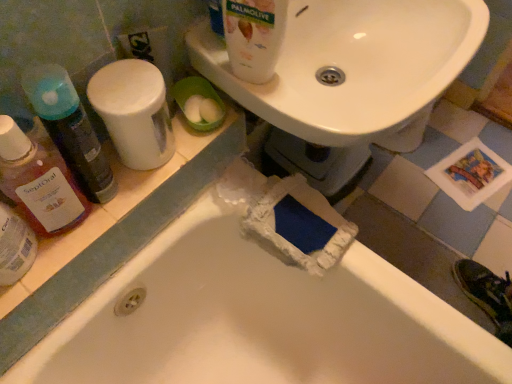
How much space does white glossy bottle at upper center, which is the 4th cleaning product in left-to-right order, occupy horizontally?

2.69 inches.

Describe the element at coordinates (134, 112) in the screenshot. I see `white plastic container at upper left, which appears as the second cleaning product when viewed from the right` at that location.

This screenshot has height=384, width=512. I want to click on white glossy sink at upper center, so click(x=352, y=65).

In order to face translucent plastic bottle at left, which ranks as the 3th cleaning product in right-to-left order, should I rotate leftwards or rightwards?

To face it directly, rotate left by 22.165 degrees.

Find the location of a particular element. The width and height of the screenshot is (512, 384). white matte bathtub at lower left is located at coordinates (259, 316).

Is translucent plastic mouthwash at left positioned beyond the bounds of white glossy bottle at upper center, which is the 4th cleaning product in left-to-right order?

Yes, translucent plastic mouthwash at left is located beyond the bounds of white glossy bottle at upper center, which is the 4th cleaning product in left-to-right order.

Between translucent plastic mouthwash at left and white glossy bottle at upper center, which is the 4th cleaning product in left-to-right order, which one has larger size?

With larger size is white glossy bottle at upper center, which is the 4th cleaning product in left-to-right order.

Can you confirm if translucent plastic mouthwash at left is positioned to the left of white glossy bottle at upper center, which is the 4th cleaning product in left-to-right order?

Yes, translucent plastic mouthwash at left is to the left of white glossy bottle at upper center, which is the 4th cleaning product in left-to-right order.

Between point (8, 233) and point (230, 21), which one is positioned in front?

The point (8, 233) is closer to the camera.

Is translucent plastic bottle at left, the fourth cleaning product in the right-to-left sequence, situated inside translucent plastic bottle at left, marked as the second cleaning product in a left-to-right arrangement, or outside?

translucent plastic bottle at left, the fourth cleaning product in the right-to-left sequence, is not inside translucent plastic bottle at left, marked as the second cleaning product in a left-to-right arrangement, it's outside.

Does point (59, 175) appear closer or farther from the camera than point (48, 119)?

Point (59, 175) is positioned farther from the camera compared to point (48, 119).

Considering the relative sizes of translucent plastic bottle at left, arranged as the 1th cleaning product when viewed from the left, and translucent plastic bottle at left, marked as the second cleaning product in a left-to-right arrangement, in the image provided, is translucent plastic bottle at left, arranged as the 1th cleaning product when viewed from the left, smaller than translucent plastic bottle at left, marked as the second cleaning product in a left-to-right arrangement,?

Yes, translucent plastic bottle at left, arranged as the 1th cleaning product when viewed from the left, is smaller than translucent plastic bottle at left, marked as the second cleaning product in a left-to-right arrangement.

Is white glossy sink at upper center thinner than translucent plastic bottle at left, the fourth cleaning product in the right-to-left sequence?

Incorrect, the width of white glossy sink at upper center is not less than that of translucent plastic bottle at left, the fourth cleaning product in the right-to-left sequence.

Can you tell me how much white glossy sink at upper center and translucent plastic bottle at left, arranged as the 1th cleaning product when viewed from the left, differ in facing direction?

There is a 1.02-degree angle between the facing directions of white glossy sink at upper center and translucent plastic bottle at left, arranged as the 1th cleaning product when viewed from the left.

Is white glossy sink at upper center inside the boundaries of translucent plastic bottle at left, the fourth cleaning product in the right-to-left sequence, or outside?

white glossy sink at upper center exists outside the volume of translucent plastic bottle at left, the fourth cleaning product in the right-to-left sequence.

Considering the positions of objects white glossy sink at upper center and translucent plastic bottle at left, the fourth cleaning product in the right-to-left sequence, in the image provided, who is behind, white glossy sink at upper center or translucent plastic bottle at left, the fourth cleaning product in the right-to-left sequence,?

→ white glossy sink at upper center is further away from the camera.

Between white matte bathtub at lower left and white glossy bottle at upper center, which is the 4th cleaning product in left-to-right order, which one has smaller width?

With smaller width is white glossy bottle at upper center, which is the 4th cleaning product in left-to-right order.

Could you measure the distance between white matte bathtub at lower left and white glossy bottle at upper center, which ranks as the 1th cleaning product in right-to-left order?

They are 48.96 centimeters apart.

How many degrees apart are the facing directions of white matte bathtub at lower left and white glossy bottle at upper center, which is the 4th cleaning product in left-to-right order?

They differ by 19.9 degrees in their facing directions.

Locate an element on the screen. This screenshot has height=384, width=512. the 4th cleaning product positioned above the white matte bathtub at lower left (from a real-world perspective) is located at coordinates (254, 37).

Considering the relative sizes of white glossy sink at upper center and white matte bathtub at lower left in the image provided, is white glossy sink at upper center shorter than white matte bathtub at lower left?

Indeed, white glossy sink at upper center has a lesser height compared to white matte bathtub at lower left.

Is white glossy sink at upper center turned away from white matte bathtub at lower left?

No, white glossy sink at upper center is not facing away from white matte bathtub at lower left.

From the picture: Who is smaller, white glossy sink at upper center or white matte bathtub at lower left?

Smaller between the two is white glossy sink at upper center.

This screenshot has width=512, height=384. Identify the location of sink behind the white matte bathtub at lower left. (352, 65).

Measure the distance between white glossy bottle at upper center, which ranks as the 1th cleaning product in right-to-left order, and translucent plastic mouthwash at left.

They are 40.52 centimeters apart.

Looking at the image, does white glossy bottle at upper center, which is the 4th cleaning product in left-to-right order, seem bigger or smaller compared to translucent plastic mouthwash at left?

white glossy bottle at upper center, which is the 4th cleaning product in left-to-right order, is bigger than translucent plastic mouthwash at left.

Can you confirm if white glossy bottle at upper center, which is the 4th cleaning product in left-to-right order, is positioned to the left of translucent plastic mouthwash at left?

Incorrect, white glossy bottle at upper center, which is the 4th cleaning product in left-to-right order, is not on the left side of translucent plastic mouthwash at left.

Which point is more distant from viewer, (246, 4) or (21, 266)?

The point (21, 266) is more distant.

From the white glossy sink at upper center, count the 3rd cleaning product to the left and point to it. Please provide its 2D coordinates.

[(70, 129)]

How many degrees apart are the facing directions of translucent plastic bottle at left, marked as the second cleaning product in a left-to-right arrangement, and white glossy sink at upper center?

3.31 degrees.

From their relative heights in the image, would you say translucent plastic bottle at left, marked as the second cleaning product in a left-to-right arrangement, is taller or shorter than white glossy sink at upper center?

Clearly, translucent plastic bottle at left, marked as the second cleaning product in a left-to-right arrangement, is taller compared to white glossy sink at upper center.

Is translucent plastic bottle at left, which ranks as the 3th cleaning product in right-to-left order, wider than white glossy sink at upper center?

No, translucent plastic bottle at left, which ranks as the 3th cleaning product in right-to-left order, is not wider than white glossy sink at upper center.

Locate an element on the screen. cleaning product that is the 4th one when counting rightward from the translucent plastic mouthwash at left is located at coordinates (254, 37).

I want to click on the 2nd cleaning product behind the translucent plastic bottle at left, arranged as the 1th cleaning product when viewed from the left, starting your count from the anchor, so click(70, 129).

Looking at the image, which one is located closer to translucent plastic mouthwash at left, translucent plastic bottle at left, marked as the second cleaning product in a left-to-right arrangement, or white plastic container at upper left, which appears as the second cleaning product when viewed from the right?

translucent plastic bottle at left, marked as the second cleaning product in a left-to-right arrangement, lies closer to translucent plastic mouthwash at left than the other object.

Based on their spatial positions, is translucent plastic mouthwash at left or white glossy bottle at upper center, which ranks as the 1th cleaning product in right-to-left order, closer to white glossy sink at upper center?

white glossy bottle at upper center, which ranks as the 1th cleaning product in right-to-left order, is positioned closer to the anchor white glossy sink at upper center.

When comparing their distances from translucent plastic mouthwash at left, does white plastic container at upper left, which ranks as the third cleaning product in left-to-right order, or translucent plastic bottle at left, arranged as the 1th cleaning product when viewed from the left, seem further?

The object further to translucent plastic mouthwash at left is white plastic container at upper left, which ranks as the third cleaning product in left-to-right order.

Considering their positions, is translucent plastic mouthwash at left positioned further to translucent plastic bottle at left, marked as the second cleaning product in a left-to-right arrangement, than white glossy sink at upper center?

white glossy sink at upper center lies further to translucent plastic bottle at left, marked as the second cleaning product in a left-to-right arrangement, than the other object.

From the image, which object appears to be nearer to translucent plastic bottle at left, which ranks as the 3th cleaning product in right-to-left order, white matte bathtub at lower left or white glossy bottle at upper center, which is the 4th cleaning product in left-to-right order?

Based on the image, white glossy bottle at upper center, which is the 4th cleaning product in left-to-right order, appears to be nearer to translucent plastic bottle at left, which ranks as the 3th cleaning product in right-to-left order.

Looking at the image, which one is located closer to translucent plastic bottle at left, arranged as the 1th cleaning product when viewed from the left, white plastic container at upper left, which ranks as the third cleaning product in left-to-right order, or white matte bathtub at lower left?

white plastic container at upper left, which ranks as the third cleaning product in left-to-right order, lies closer to translucent plastic bottle at left, arranged as the 1th cleaning product when viewed from the left, than the other object.

Looking at the image, which one is located further to translucent plastic mouthwash at left, white glossy sink at upper center or white glossy bottle at upper center, which is the 4th cleaning product in left-to-right order?

Among the two, white glossy sink at upper center is located further to translucent plastic mouthwash at left.

Based on their spatial positions, is white plastic container at upper left, which ranks as the third cleaning product in left-to-right order, or white matte bathtub at lower left closer to translucent plastic mouthwash at left?

white plastic container at upper left, which ranks as the third cleaning product in left-to-right order.

I want to click on mouthwash that lies between translucent plastic bottle at left, marked as the second cleaning product in a left-to-right arrangement, and white matte bathtub at lower left from top to bottom, so click(15, 246).

This screenshot has height=384, width=512. What are the coordinates of `mouthwash between white glossy sink at upper center and white matte bathtub at lower left in the vertical direction` in the screenshot? It's located at (15, 246).

The image size is (512, 384). What are the coordinates of `mouthwash that lies between white glossy bottle at upper center, which is the 4th cleaning product in left-to-right order, and white matte bathtub at lower left from top to bottom` in the screenshot? It's located at (15, 246).

Find the location of a particular element. This screenshot has height=384, width=512. cleaning product between translucent plastic bottle at left, which ranks as the 3th cleaning product in right-to-left order, and white matte bathtub at lower left in the up-down direction is located at coordinates (39, 182).